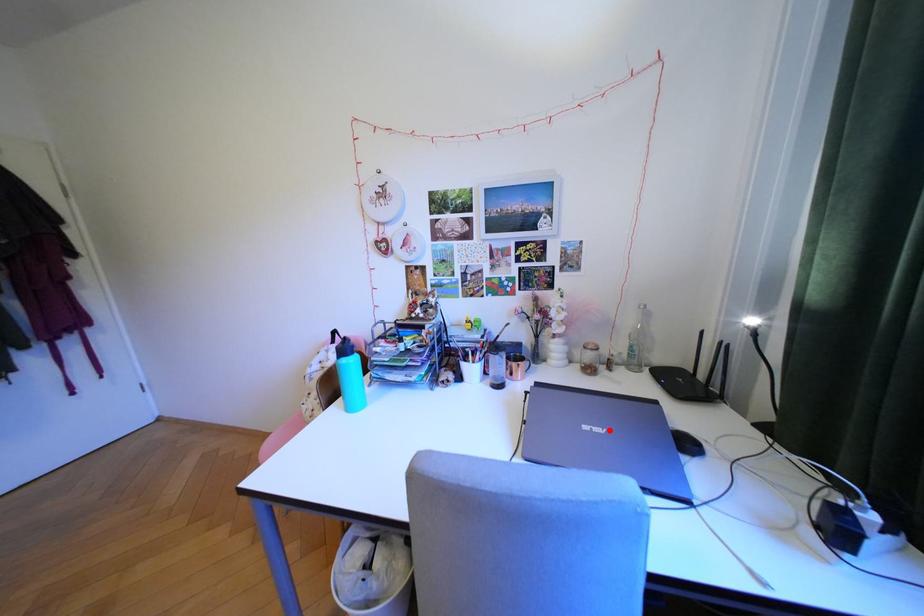
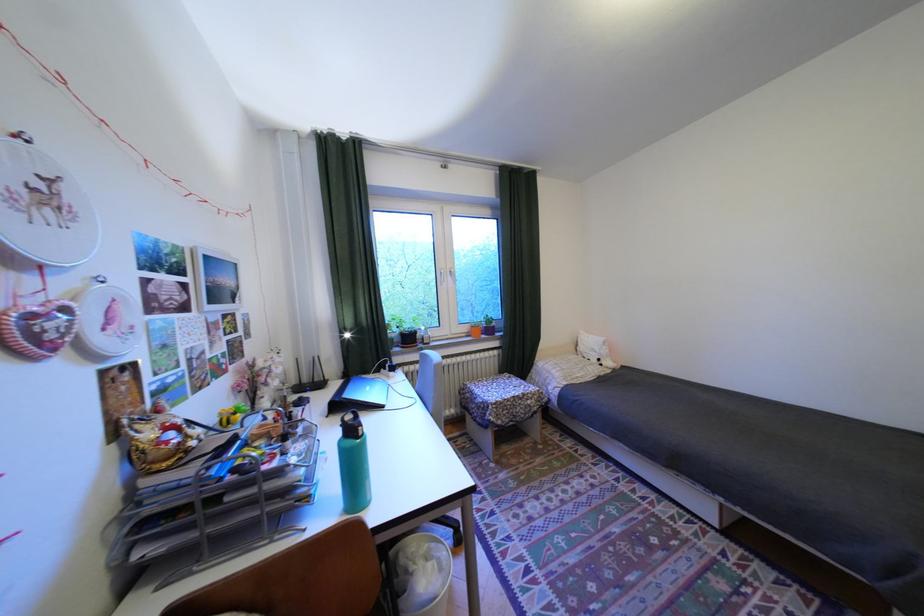
The point at the highlighted location is marked in the first image. Where is the corresponding point in the second image?

(380, 387)